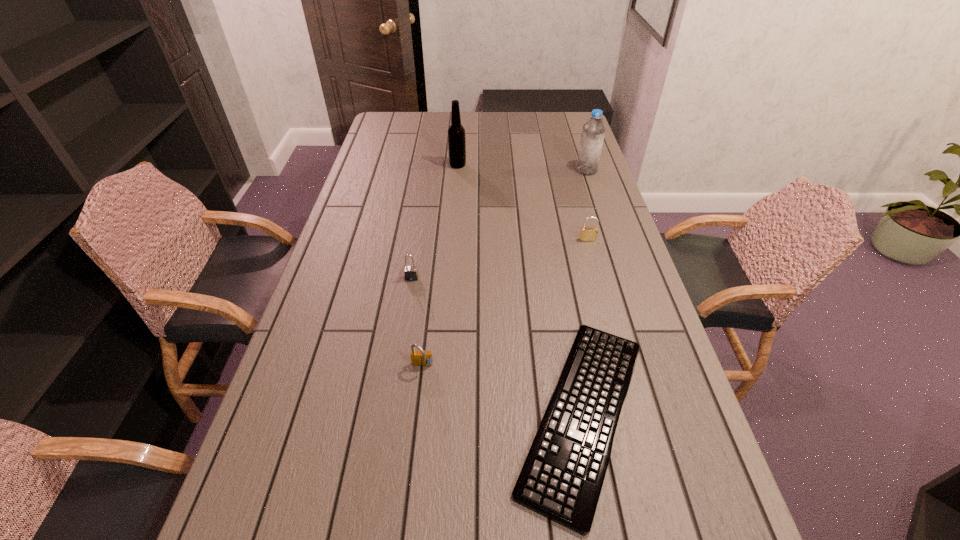
Locate an element on the screen. This screenshot has height=540, width=960. beer bottle is located at coordinates (456, 133).

Identify the location of water bottle. click(x=593, y=131).

At what (x,y) coordinates should I click in order to perform the action: click on the rightmost padlock. Please return your answer as a coordinate pair (x, y). Image resolution: width=960 pixels, height=540 pixels. Looking at the image, I should click on (586, 233).

Identify the location of the farthest padlock. This screenshot has width=960, height=540. (586, 233).

This screenshot has height=540, width=960. Find the location of `the leftmost padlock`. the leftmost padlock is located at coordinates (411, 273).

You are a GUI agent. You are given a task and a screenshot of the screen. Output one action in this format:
    pyautogui.click(x=<x>, y=<y>)
    Task: Click on the leftmost object
    Image resolution: width=960 pixels, height=540 pixels.
    Given the screenshot: What is the action you would take?
    pyautogui.click(x=411, y=273)

The height and width of the screenshot is (540, 960). I want to click on the nearest padlock, so click(x=420, y=357).

The image size is (960, 540). In order to click on the shortest object in this screenshot , I will do coord(561,479).

Find the location of `vacant space located 0.120m on the back of the beer bottle`. vacant space located 0.120m on the back of the beer bottle is located at coordinates (459, 146).

The width and height of the screenshot is (960, 540). What are the coordinates of `vacant space located 0.100m on the back of the water bottle` in the screenshot? It's located at (581, 152).